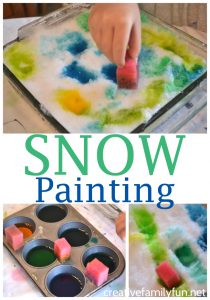
What are the coordinates of `wood wall` in the screenshot? It's located at (181, 8).